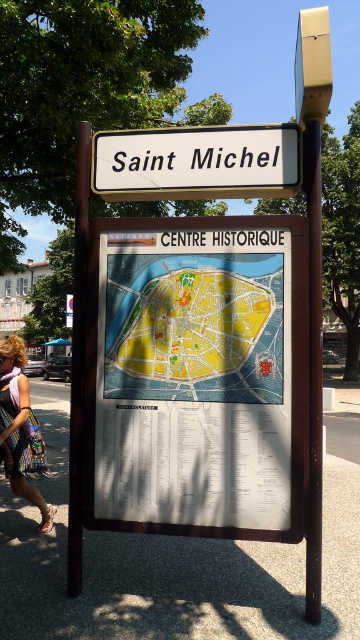
Is white paper map at center above white plastic sign at upper center?

No.

Does white paper map at center lie behind white plastic sign at upper center?

That is False.

Who is more distant from viewer, (230, 291) or (221, 152)?

The point (221, 152) is more distant.

The height and width of the screenshot is (640, 360). Identify the location of white paper map at center. (195, 374).

Can you confirm if yellow paper map at center is positioned below white plastic sign at upper center?

Yes, yellow paper map at center is below white plastic sign at upper center.

Consider the image. Does yellow paper map at center appear on the right side of white plastic sign at upper center?

Incorrect, yellow paper map at center is not on the right side of white plastic sign at upper center.

This screenshot has width=360, height=640. What are the coordinates of `yellow paper map at center` in the screenshot? It's located at (195, 326).

Does point (97, 164) lie in front of point (74, 272)?

Yes, it is.

Can you confirm if white plastic sign at upper center is positioned to the left of brown wooden pole at left?

Incorrect, white plastic sign at upper center is not on the left side of brown wooden pole at left.

Between point (280, 157) and point (75, 470), which one is positioned behind?

The point (75, 470) is behind.

The image size is (360, 640). I want to click on white plastic sign at upper center, so click(x=196, y=163).